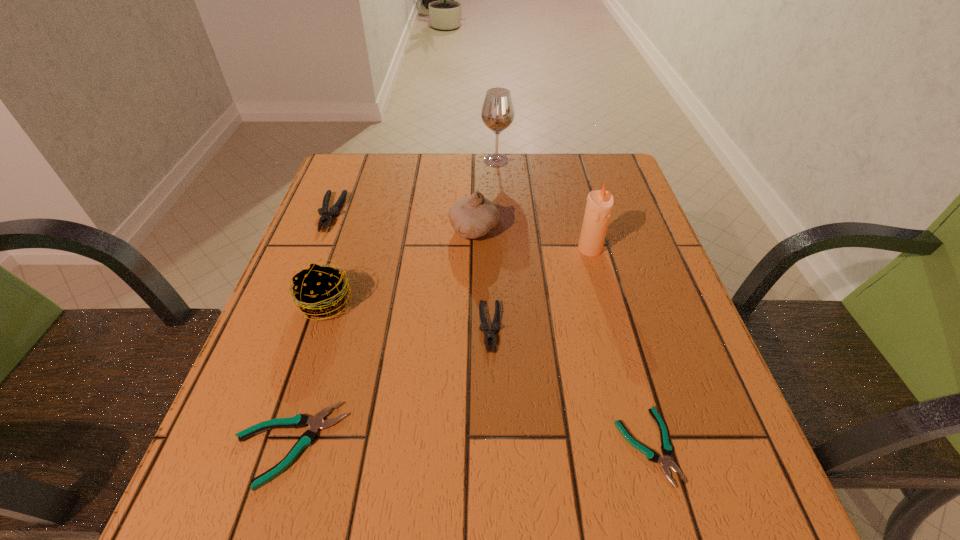
Find the location of a particular element. empty space that is in between the bigger teal pliers and the bigger gray pliers is located at coordinates (309, 329).

Image resolution: width=960 pixels, height=540 pixels. I want to click on vacant space in between the fourth tallest object and the right gray pliers, so click(408, 315).

I want to click on free spot between the second shortest pliers and the farthest object, so click(393, 302).

Identify the location of unoccupied position between the sixth tallest object and the farthest object. The width and height of the screenshot is (960, 540). (493, 244).

Where is `object identified as the fourth closest to the fifth tallest object`? Image resolution: width=960 pixels, height=540 pixels. object identified as the fourth closest to the fifth tallest object is located at coordinates (489, 334).

Locate which object is the fifth closest to the candle. Please provide its 2D coordinates. Your answer should be formatted as a tuple, i.e. [(x, y)], where the tuple contains the x and y coordinates of a point satisfying the conditions above.

[(320, 291)]

Where is `pliers that stands as the second closest to the garlic`? The height and width of the screenshot is (540, 960). pliers that stands as the second closest to the garlic is located at coordinates (327, 216).

Find the location of a particular element. This screenshot has width=960, height=540. pliers that is the third closest to the shortest pliers is located at coordinates (327, 216).

Identify the location of vacant position in the image that satisfies the following two spatial constraints: 1. at the gripping part of the sixth shortest object; 2. on the right side of the fifth tallest object. Image resolution: width=960 pixels, height=540 pixels. (324, 230).

I want to click on vacant area that satisfies the following two spatial constraints: 1. at the gripping part of the sixth tallest object; 2. on the left side of the right teal pliers, so click(x=492, y=446).